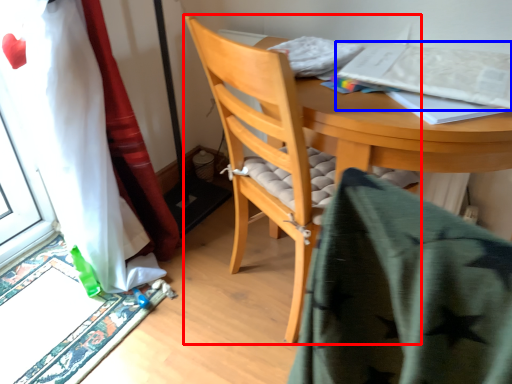
Question: Which point is further to the camera, chair (highlighted by a red box) or paperback book (highlighted by a blue box)?

Choices:
 (A) chair
 (B) paperback book

Answer: (B)